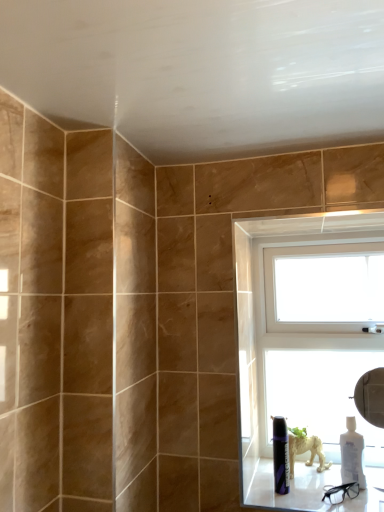
Locate an element on the screen. The width and height of the screenshot is (384, 512). matte black can at lower right is located at coordinates (281, 455).

What is the approximate width of white glossy bottle at lower right?

8.84 centimeters.

At what (x,y) coordinates should I click in order to perform the action: click on matte black can at lower right. Please return your answer as a coordinate pair (x, y). Looking at the image, I should click on (281, 455).

Is white plastic window at upper right closer to camera compared to white glossy window sill at lower right?

That is False.

Between white plastic window at upper right and white glossy window sill at lower right, which one has smaller size?

Smaller between the two is white glossy window sill at lower right.

Is white glossy window sill at lower right a part of white plastic window at upper right?

No, white plastic window at upper right does not contain white glossy window sill at lower right.

In terms of height, does white glossy window sill at lower right look taller or shorter compared to white glossy bottle at lower right?

white glossy window sill at lower right is shorter than white glossy bottle at lower right.

Would you say white glossy window sill at lower right is outside white glossy bottle at lower right?

Yes, white glossy window sill at lower right is located beyond the bounds of white glossy bottle at lower right.

Considering the sizes of objects white glossy window sill at lower right and white glossy bottle at lower right in the image provided, who is wider, white glossy window sill at lower right or white glossy bottle at lower right?

white glossy window sill at lower right is wider.

In terms of height, does matte black can at lower right look taller or shorter compared to white glossy bottle at lower right?

In the image, matte black can at lower right appears to be taller than white glossy bottle at lower right.

Visually, is matte black can at lower right positioned to the left or to the right of white glossy bottle at lower right?

Clearly, matte black can at lower right is on the left of white glossy bottle at lower right in the image.

Is matte black can at lower right positioned in front of white glossy bottle at lower right?

Yes, it is in front of white glossy bottle at lower right.

Is white glossy bottle at lower right inside matte black can at lower right?

→ No, white glossy bottle at lower right is located outside of matte black can at lower right.

From the image's perspective, is white plastic window at upper right located above or below white glossy bottle at lower right?

white plastic window at upper right is above white glossy bottle at lower right.

Which is closer to the camera, [369,335] or [352,461]?

Point [369,335] appears to be farther away from the viewer than point [352,461].

Considering the relative sizes of white plastic window at upper right and white glossy bottle at lower right in the image provided, is white plastic window at upper right smaller than white glossy bottle at lower right?

Actually, white plastic window at upper right might be larger than white glossy bottle at lower right.

Is white plastic window at upper right positioned in front of white glossy bottle at lower right?

No, it is behind white glossy bottle at lower right.

Is point (341, 460) behind point (250, 443)?

No, it is in front of (250, 443).

Is white glossy bottle at lower right next to white plastic window at upper right and touching it?

white glossy bottle at lower right is not next to white plastic window at upper right, and they're not touching.

From the image's perspective, which one is positioned lower, white glossy bottle at lower right or white plastic window at upper right?

white glossy bottle at lower right.

In terms of height, does white glossy bottle at lower right look taller or shorter compared to white plastic window at upper right?

Considering their sizes, white glossy bottle at lower right has less height than white plastic window at upper right.

Is white plastic window at upper right positioned with its back to matte black can at lower right?

No, white plastic window at upper right is not facing away from matte black can at lower right.

From the image's perspective, who appears lower, white plastic window at upper right or matte black can at lower right?

matte black can at lower right is shown below in the image.

Between white plastic window at upper right and matte black can at lower right, which one has smaller size?

matte black can at lower right is smaller.

From the picture: Can you tell me how much white plastic window at upper right and matte black can at lower right differ in facing direction?

The angular difference between white plastic window at upper right and matte black can at lower right is 0.000538 degrees.

Does white glossy window sill at lower right appear on the right side of matte black can at lower right?

Indeed, white glossy window sill at lower right is positioned on the right side of matte black can at lower right.

Based on the photo, is white glossy window sill at lower right bigger than matte black can at lower right?

Correct, white glossy window sill at lower right is larger in size than matte black can at lower right.

Between white glossy window sill at lower right and matte black can at lower right, which one has smaller width?

matte black can at lower right is thinner.

How much distance is there between white glossy window sill at lower right and matte black can at lower right?

They are 3.83 inches apart.

The height and width of the screenshot is (512, 384). I want to click on window sill on the left of white plastic window at upper right, so click(x=311, y=489).

The width and height of the screenshot is (384, 512). What are the coordinates of `bottle above the white glossy window sill at lower right (from a real-world perspective)` in the screenshot? It's located at click(x=352, y=454).

Based on their spatial positions, is matte black can at lower right or white glossy window sill at lower right further from white glossy bottle at lower right?

Based on the image, matte black can at lower right appears to be further to white glossy bottle at lower right.

Consider the image. Considering their positions, is white plastic window at upper right positioned closer to white glossy bottle at lower right than matte black can at lower right?

matte black can at lower right lies closer to white glossy bottle at lower right than the other object.

From the image, which object appears to be farther from matte black can at lower right, white plastic window at upper right or white glossy bottle at lower right?

The object further to matte black can at lower right is white plastic window at upper right.

Based on their spatial positions, is white glossy window sill at lower right or white glossy bottle at lower right further from matte black can at lower right?

Among the two, white glossy bottle at lower right is located further to matte black can at lower right.

Based on their spatial positions, is matte black can at lower right or white glossy bottle at lower right further from white plastic window at upper right?

white glossy bottle at lower right lies further to white plastic window at upper right than the other object.

Estimate the real-world distances between objects in this image. Which object is further from white plastic window at upper right, white glossy window sill at lower right or white glossy bottle at lower right?

white glossy bottle at lower right is positioned further to the anchor white plastic window at upper right.

From the image, which object appears to be nearer to matte black can at lower right, white glossy window sill at lower right or white plastic window at upper right?

Based on the image, white glossy window sill at lower right appears to be nearer to matte black can at lower right.

Which object lies further to the anchor point matte black can at lower right, white glossy bottle at lower right or white glossy window sill at lower right?

white glossy bottle at lower right.

Locate an element on the screen. Image resolution: width=384 pixels, height=512 pixels. window sill between matte black can at lower right and white glossy bottle at lower right from left to right is located at coordinates (311, 489).

The height and width of the screenshot is (512, 384). I want to click on bottle that lies between white plastic window at upper right and white glossy window sill at lower right from top to bottom, so [x=352, y=454].

Locate an element on the screen. This screenshot has width=384, height=512. toiletry between white plastic window at upper right and white glossy window sill at lower right in the up-down direction is located at coordinates coord(281,455).

Where is `toiletry between white plastic window at upper right and white glossy bottle at lower right in the vertical direction`? toiletry between white plastic window at upper right and white glossy bottle at lower right in the vertical direction is located at coordinates (281, 455).